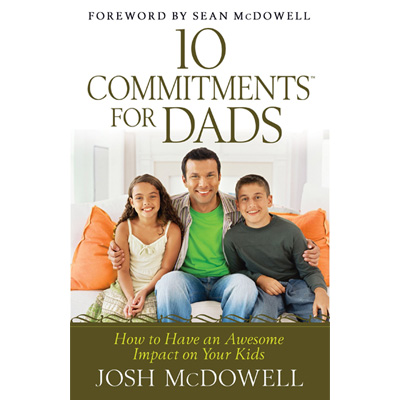
I want to click on cushion, so click(313, 222).